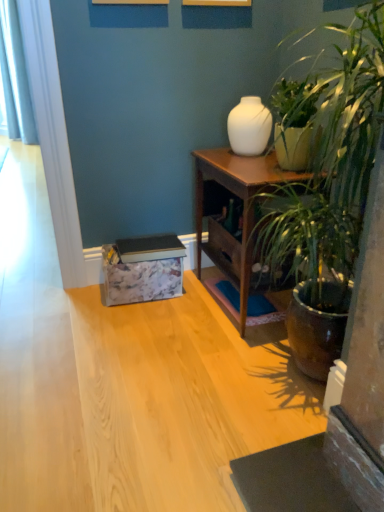
Question: Looking at their shapes, would you say white fabric curtain at left is wider or thinner than wooden nightstand at center-right?

Choices:
 (A) thin
 (B) wide

Answer: (B)

Question: Does point (16, 37) appear closer or farther from the camera than point (200, 153)?

Choices:
 (A) farther
 (B) closer

Answer: (A)

Question: Estimate the real-world distances between objects in this image. Which object is closer to the green leafy plant at right?

Choices:
 (A) wooden nightstand at center-right
 (B) white fabric curtain at left
 (C) white glossy vase at upper center

Answer: (A)

Question: Considering the real-world distances, which object is farthest from the wooden nightstand at center-right?

Choices:
 (A) white fabric curtain at left
 (B) white glossy vase at upper center
 (C) green leafy plant at right

Answer: (A)